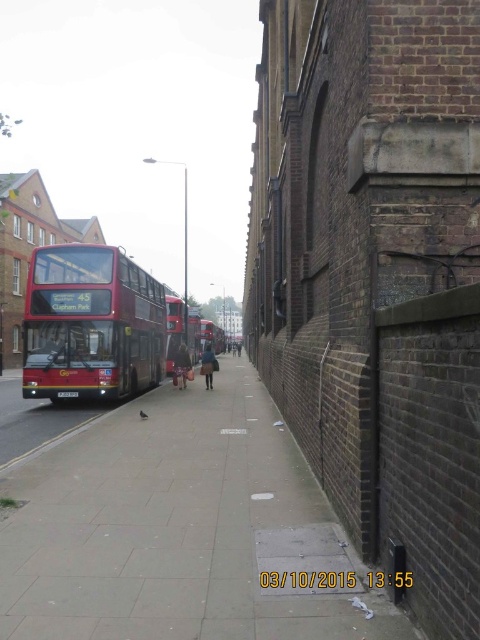
Who is positioned more to the right, smooth concrete pavement at center or red matte bus at center?

Positioned to the right is red matte bus at center.

Who is positioned more to the left, smooth concrete pavement at center or red matte bus at center?

smooth concrete pavement at center

Who is more distant from viewer, (303,528) or (219,342)?

The point (219,342) is behind.

I want to click on smooth concrete pavement at center, so click(x=179, y=529).

Which is above, red matte double-decker bus at left or dark brown leather coat at center?

red matte double-decker bus at left

Does red matte double-decker bus at left appear under dark brown leather coat at center?

Incorrect, red matte double-decker bus at left is not positioned below dark brown leather coat at center.

Between point (92, 308) and point (213, 352), which one is positioned behind?

The point (213, 352) is more distant.

This screenshot has width=480, height=640. I want to click on red matte double-decker bus at left, so click(91, 324).

Who is lower down, red matte bus at center or dark blue fabric coat at center?

dark blue fabric coat at center

How far apart are red matte bus at center and dark blue fabric coat at center?

A distance of 41.85 meters exists between red matte bus at center and dark blue fabric coat at center.

Locate an element on the screen. The image size is (480, 640). red matte bus at center is located at coordinates (212, 336).